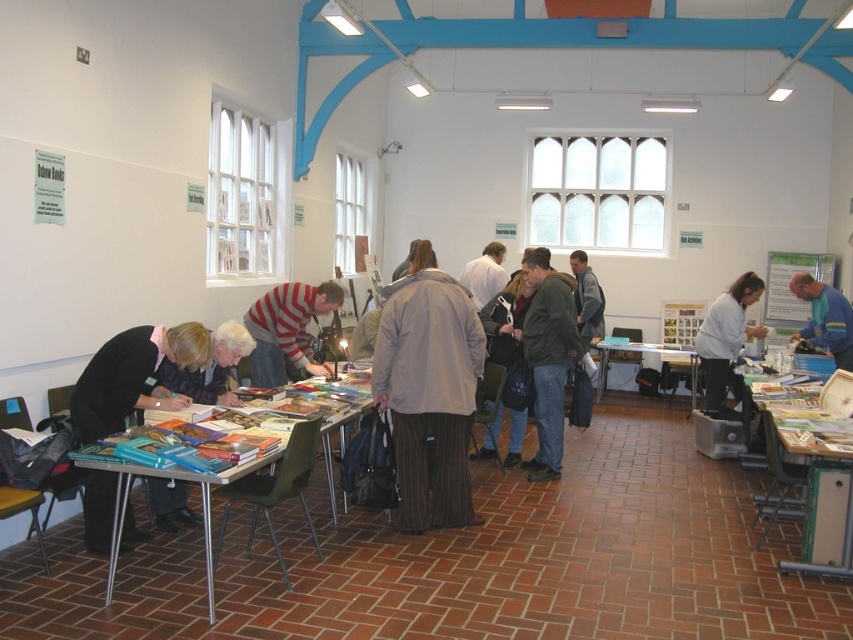
Is striped shirt at center wider than smooth beige coat at center?

Yes.

Who is more forward, (281, 378) or (393, 276)?

Point (281, 378) is in front.

Find the location of a particular element. striped shirt at center is located at coordinates (287, 330).

Can you confirm if blue fabric shirt at right is taller than white fabric jacket at center?

Yes.

Identify the location of blue fabric shirt at right. (824, 317).

Is point (804, 285) positioned behind point (479, 298)?

No, (804, 285) is in front of (479, 298).

Find the location of a particular element. This screenshot has width=853, height=640. blue fabric shirt at right is located at coordinates (824, 317).

Between point (115, 419) and point (164, 385), which one is positioned behind?

Point (164, 385)

Is black fabric at lower left to the right of black fabric jacket at lower left from the viewer's perspective?

No, black fabric at lower left is not to the right of black fabric jacket at lower left.

Does point (202, 349) come closer to viewer compared to point (231, 365)?

Yes, it is.

The image size is (853, 640). In order to click on black fabric at lower left in this screenshot , I will do `click(132, 376)`.